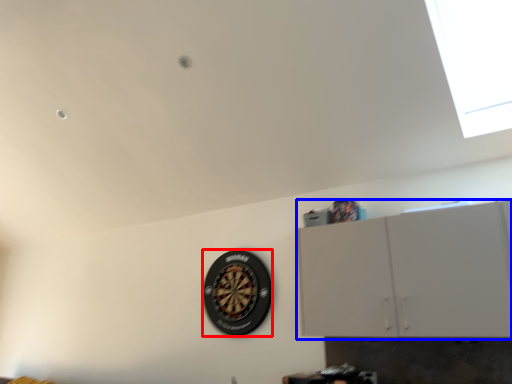
Question: Among these objects, which one is nearest to the camera, wheel (highlighted by a red box) or cabinetry (highlighted by a blue box)?

Choices:
 (A) wheel
 (B) cabinetry

Answer: (B)